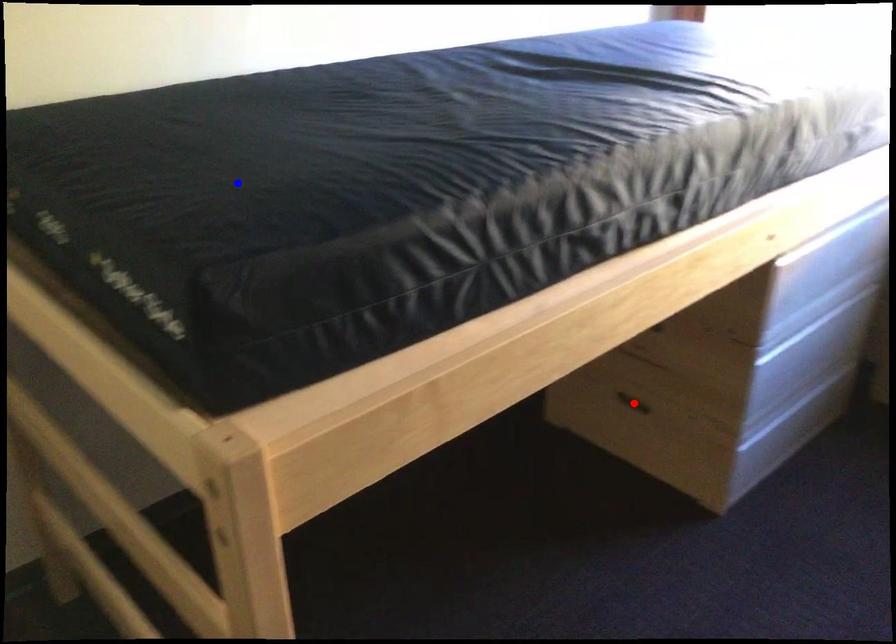
Question: In the image, two points are highlighted. Which point is nearer to the camera? Reply with the corresponding letter.

Choices:
 (A) blue point
 (B) red point

Answer: (A)